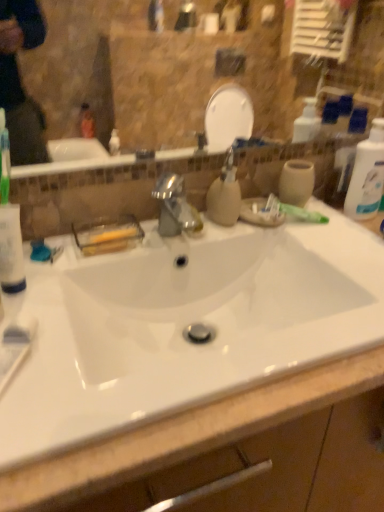
Question: Considering the relative sizes of matte beige soap dispenser at center and white plastic bottle at right in the image provided, is matte beige soap dispenser at center shorter than white plastic bottle at right?

Choices:
 (A) no
 (B) yes

Answer: (B)

Question: Is there a large distance between matte beige soap dispenser at center and white plastic bottle at right?

Choices:
 (A) yes
 (B) no

Answer: (B)

Question: From the image's perspective, is matte beige soap dispenser at center located beneath white plastic bottle at right?

Choices:
 (A) no
 (B) yes

Answer: (B)

Question: From a real-world perspective, is matte beige soap dispenser at center located beneath white plastic bottle at right?

Choices:
 (A) no
 (B) yes

Answer: (B)

Question: From a real-world perspective, is matte beige soap dispenser at center positioned over white plastic bottle at right based on gravity?

Choices:
 (A) yes
 (B) no

Answer: (B)

Question: In terms of height, does green matte toothpaste at upper right look taller or shorter compared to white glossy sink at center?

Choices:
 (A) short
 (B) tall

Answer: (A)

Question: In terms of width, does green matte toothpaste at upper right look wider or thinner when compared to white glossy sink at center?

Choices:
 (A) thin
 (B) wide

Answer: (A)

Question: Which is correct: green matte toothpaste at upper right is inside white glossy sink at center, or outside of it?

Choices:
 (A) outside
 (B) inside

Answer: (A)

Question: Is green matte toothpaste at upper right bigger or smaller than white glossy sink at center?

Choices:
 (A) big
 (B) small

Answer: (B)

Question: From the image's perspective, is white glossy sink at center above or below white plastic bottle at right?

Choices:
 (A) below
 (B) above

Answer: (A)

Question: Which is correct: white glossy sink at center is inside white plastic bottle at right, or outside of it?

Choices:
 (A) inside
 (B) outside

Answer: (B)

Question: Is white glossy sink at center in front of or behind white plastic bottle at right in the image?

Choices:
 (A) behind
 (B) front

Answer: (B)

Question: Based on their positions, is white glossy sink at center located to the left or right of white plastic bottle at right?

Choices:
 (A) left
 (B) right

Answer: (A)

Question: In terms of width, does white plastic bottle at right look wider or thinner when compared to white glossy sink at center?

Choices:
 (A) thin
 (B) wide

Answer: (A)

Question: Is point [369, 217] closer or farther from the camera than point [114, 349]?

Choices:
 (A) farther
 (B) closer

Answer: (A)